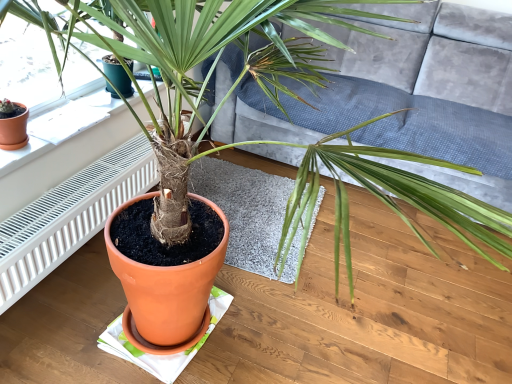
Where is `gray soft rug at center`? gray soft rug at center is located at coordinates (245, 210).

Measure the distance between point (348, 32) and camera.

Point (348, 32) is 2.36 meters from camera.

Where is `gray soft rug at center`? The width and height of the screenshot is (512, 384). gray soft rug at center is located at coordinates (245, 210).

Is point (260, 252) closer or farther from the camera than point (37, 124)?

Point (260, 252) is positioned farther from the camera compared to point (37, 124).

From a real-world perspective, between gray soft rug at center and white paper at upper left, who is vertically higher?

In real-world perspective, white paper at upper left is above.

Would you consider gray soft rug at center to be distant from white paper at upper left?

No, gray soft rug at center is not far from white paper at upper left.

Choose the correct answer: Is gray soft rug at center inside white paper at upper left or outside it?

gray soft rug at center is spatially situated outside white paper at upper left.

Consider the image. Between gray soft rug at center and white textured radiator at left, which one has larger size?

white textured radiator at left.

Between gray soft rug at center and white textured radiator at left, which one has less height?

gray soft rug at center.

How many degrees apart are the facing directions of gray soft rug at center and white textured radiator at left?

They differ by 85.3 degrees in their facing directions.

Between gray soft rug at center and white textured radiator at left, which one has larger width?

gray soft rug at center.

Consider the image. From the image's perspective, which one is positioned higher, velvet grey couch at center or white textured radiator at left?

velvet grey couch at center, from the image's perspective.

Is velvet grey couch at center not near white textured radiator at left?

That's right, there is a large distance between velvet grey couch at center and white textured radiator at left.

From a real-world perspective, is velvet grey couch at center located beneath white textured radiator at left?

Incorrect, from a real-world perspective, velvet grey couch at center is higher than white textured radiator at left.

Would you say velvet grey couch at center contains white textured radiator at left?

Actually, white textured radiator at left is outside velvet grey couch at center.

Is gray soft rug at center further to the viewer compared to velvet grey couch at center?

Yes, gray soft rug at center is behind velvet grey couch at center.

Does gray soft rug at center have a lesser width compared to velvet grey couch at center?

Correct, the width of gray soft rug at center is less than that of velvet grey couch at center.

Is gray soft rug at center looking in the opposite direction of velvet grey couch at center?

Yes.

Considering the sizes of white paper at upper left and white textured radiator at left in the image, is white paper at upper left wider or thinner than white textured radiator at left?

Considering their sizes, white paper at upper left looks slimmer than white textured radiator at left.

Is point (81, 106) positioned in front of point (146, 154)?

Yes, point (81, 106) is closer to viewer.

Considering the relative sizes of white paper at upper left and white textured radiator at left in the image provided, is white paper at upper left taller than white textured radiator at left?

Incorrect, the height of white paper at upper left is not larger of that of white textured radiator at left.

Between velvet grey couch at center and gray soft rug at center, which one has more height?

Standing taller between the two is velvet grey couch at center.

Which is further, (269, 138) or (226, 171)?

The point (226, 171) is farther from the camera.

In the scene shown: Is velvet grey couch at center positioned far away from gray soft rug at center?

Actually, velvet grey couch at center and gray soft rug at center are a little close together.

How much distance is there between white textured radiator at left and white paper at upper left?

The distance of white textured radiator at left from white paper at upper left is 9.43 inches.

Would you say white textured radiator at left is a long distance from white paper at upper left?

white textured radiator at left is near white paper at upper left, not far away.

Where is `radiator that is below the white paper at upper left (from the image's perspective)`? This screenshot has height=384, width=512. radiator that is below the white paper at upper left (from the image's perspective) is located at coordinates (69, 217).

Is white paper at upper left at the back of white textured radiator at left?

No, white textured radiator at left is not facing the opposite direction of white paper at upper left.

In order to click on mat below the white paper at upper left (from a real-world perspective) in this screenshot , I will do `click(245, 210)`.

This screenshot has width=512, height=384. Identify the location of mat lying on the right of white textured radiator at left. (245, 210).

From the image, which object appears to be farther from white paper at upper left, gray soft rug at center or velvet grey couch at center?

velvet grey couch at center is further to white paper at upper left.

Looking at the image, which one is located further to white textured radiator at left, gray soft rug at center or white paper at upper left?

gray soft rug at center is positioned further to the anchor white textured radiator at left.

Which object lies further to the anchor point velvet grey couch at center, white textured radiator at left or white paper at upper left?

Based on the image, white paper at upper left appears to be further to velvet grey couch at center.

Looking at the image, which one is located closer to white textured radiator at left, velvet grey couch at center or white paper at upper left?

The object closer to white textured radiator at left is white paper at upper left.

Estimate the real-world distances between objects in this image. Which object is closer to velvet grey couch at center, white textured radiator at left or gray soft rug at center?

The object closer to velvet grey couch at center is gray soft rug at center.

Looking at the image, which one is located closer to white textured radiator at left, velvet grey couch at center or gray soft rug at center?

gray soft rug at center.

Based on their spatial positions, is velvet grey couch at center or white textured radiator at left closer to white paper at upper left?

The object closer to white paper at upper left is white textured radiator at left.

Looking at the image, which one is located further to white textured radiator at left, white paper at upper left or gray soft rug at center?

Among the two, gray soft rug at center is located further to white textured radiator at left.

The image size is (512, 384). Find the location of `mat between white paper at upper left and velvet grey couch at center in the horizontal direction`. mat between white paper at upper left and velvet grey couch at center in the horizontal direction is located at coordinates (245, 210).

Where is `radiator between white paper at upper left and velvet grey couch at center in the horizontal direction`? The image size is (512, 384). radiator between white paper at upper left and velvet grey couch at center in the horizontal direction is located at coordinates (69, 217).

Locate an element on the screen. radiator between white paper at upper left and gray soft rug at center is located at coordinates (69, 217).

Locate an element on the screen. Image resolution: width=512 pixels, height=384 pixels. mat between white textured radiator at left and velvet grey couch at center from left to right is located at coordinates (245, 210).